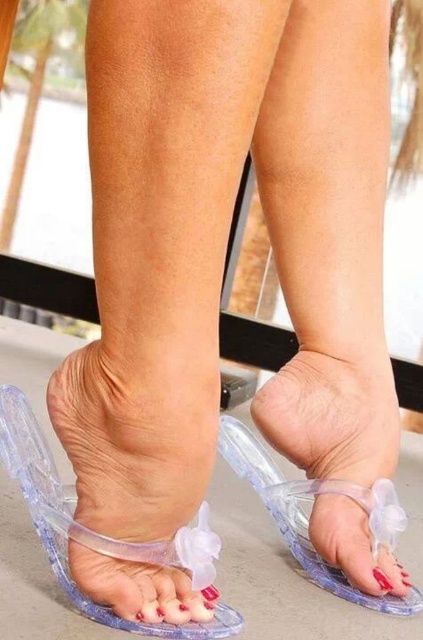
Which is below, transparent plastic flip-flop at center or clear plastic toe at center?

clear plastic toe at center is below.

This screenshot has width=423, height=640. Identify the location of transparent plastic flip-flop at center. (340, 483).

Between point (161, 410) and point (365, 588), which one is positioned behind?

Point (365, 588)

Consider the image. Which is above, transparent plastic flip-flop at lower center or transparent plastic flip-flop at center?

transparent plastic flip-flop at lower center is above.

I want to click on transparent plastic flip-flop at lower center, so click(131, 440).

Does transparent plastic flip-flop at lower center appear on the left side of clear plastic toe at center?

Indeed, transparent plastic flip-flop at lower center is positioned on the left side of clear plastic toe at center.

Between point (175, 451) and point (390, 592), which one is positioned behind?

Point (390, 592)

Where is `transparent plastic flip-flop at lower center`? transparent plastic flip-flop at lower center is located at coordinates (131, 440).